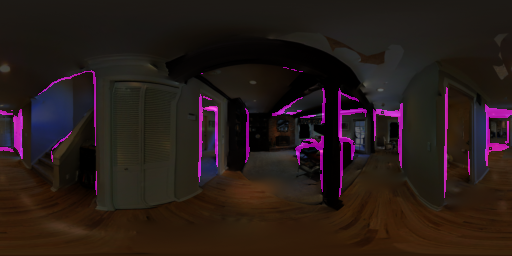
What are the coordinates of `fireplace` in the screenshot? It's located at (283, 138).